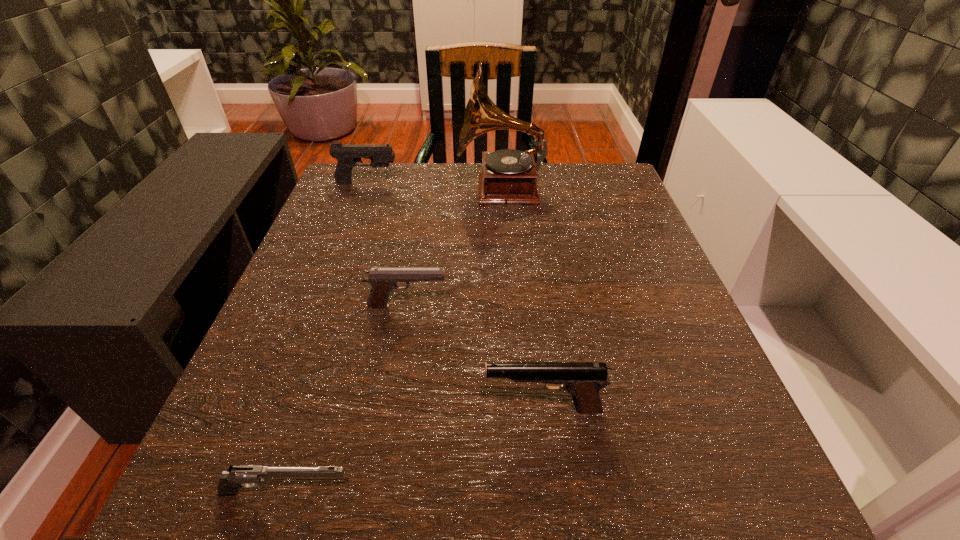
What are the coordinates of `free spot between the fourth farthest object and the phonograph_record` in the screenshot? It's located at (522, 300).

This screenshot has width=960, height=540. What are the coordinates of `unoccupied area between the farthest pistol and the third nearest object` in the screenshot? It's located at (387, 245).

Identify the location of empty location between the second farthest pistol and the shortest pistol. (347, 400).

Where is `vacant point located between the tallest object and the third farthest pistol`? vacant point located between the tallest object and the third farthest pistol is located at coordinates (522, 300).

Where is `empty location between the shortest pistol and the second nearest pistol`? This screenshot has width=960, height=540. empty location between the shortest pistol and the second nearest pistol is located at coordinates (415, 451).

In order to click on vacant area that lies between the second nearest pistol and the phonograph_record in this screenshot , I will do `click(522, 300)`.

Identify the location of free spot between the nearest object and the second shortest object. (347, 400).

Identify which object is located as the second nearest to the third farthest pistol. Please provide its 2D coordinates. Your answer should be formatted as a tuple, i.e. [(x, y)], where the tuple contains the x and y coordinates of a point satisfying the conditions above.

[(383, 280)]

Choose which object is the nearest neighbor to the farthest pistol. Please provide its 2D coordinates. Your answer should be formatted as a tuple, i.e. [(x, y)], where the tuple contains the x and y coordinates of a point satisfying the conditions above.

[(508, 176)]

I want to click on the third closest pistol to the fourth tallest object, so click(x=347, y=156).